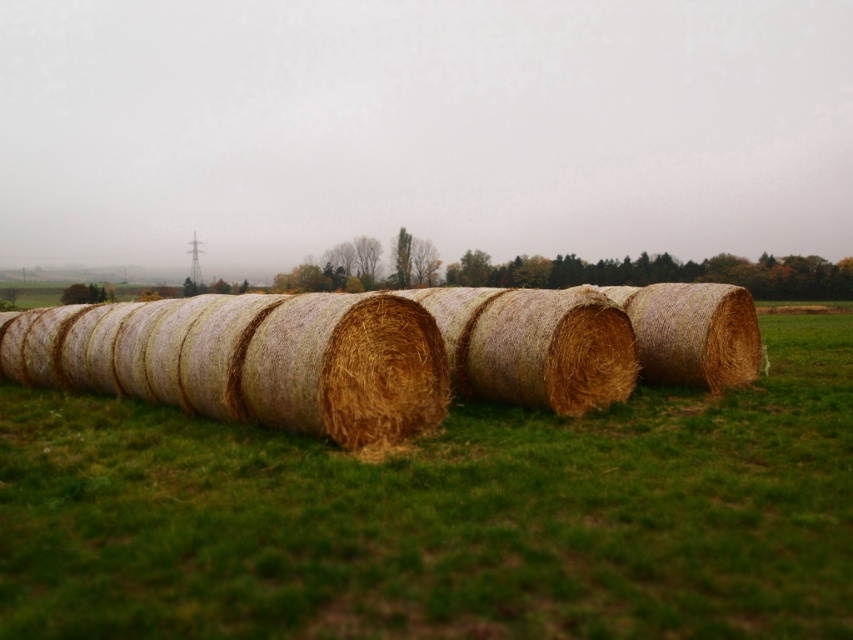
Question: Which of the following is the farthest from the observer?

Choices:
 (A) (321, 353)
 (B) (671, 440)

Answer: (B)

Question: Observing the image, what is the correct spatial positioning of green grass at center in reference to golden straw bales at center?

Choices:
 (A) right
 (B) left

Answer: (A)

Question: Does green grass at center have a smaller size compared to golden straw bales at center?

Choices:
 (A) no
 (B) yes

Answer: (B)

Question: Can you confirm if green grass at center is positioned to the left of golden straw bales at center?

Choices:
 (A) yes
 (B) no

Answer: (B)

Question: Which of the following is the closest to the observer?

Choices:
 (A) (611, 316)
 (B) (440, 435)

Answer: (B)